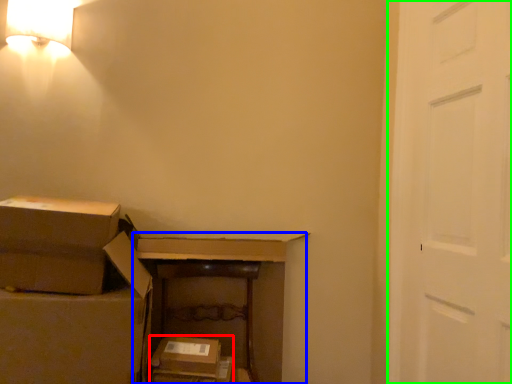
Question: Considering the real-world distances, which object is farthest from storage box (highlighted by a red box)? dresser (highlighted by a blue box) or door (highlighted by a green box)?

Choices:
 (A) dresser
 (B) door

Answer: (B)